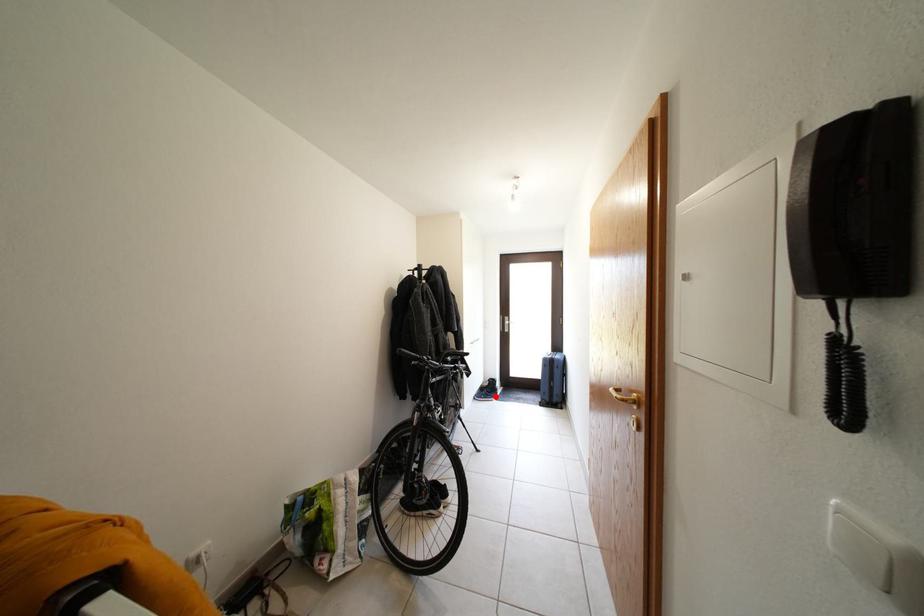
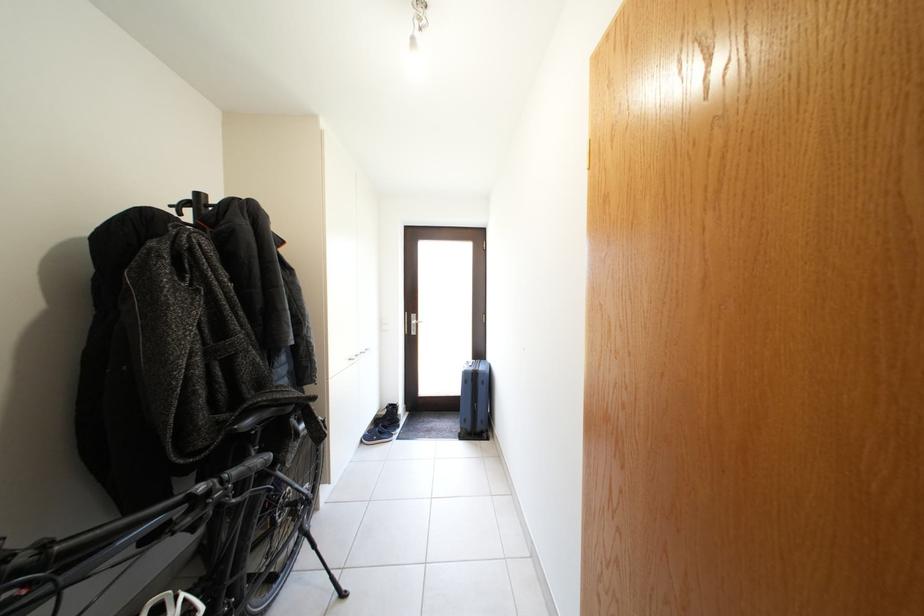
Question: A red point is marked in image1. In image2, is the corresponding 3D point closer to the camera or farther? Reply with the corresponding letter.

Choices:
 (A) The corresponding 3D point is closer.
 (B) The corresponding 3D point is farther.

Answer: (A)